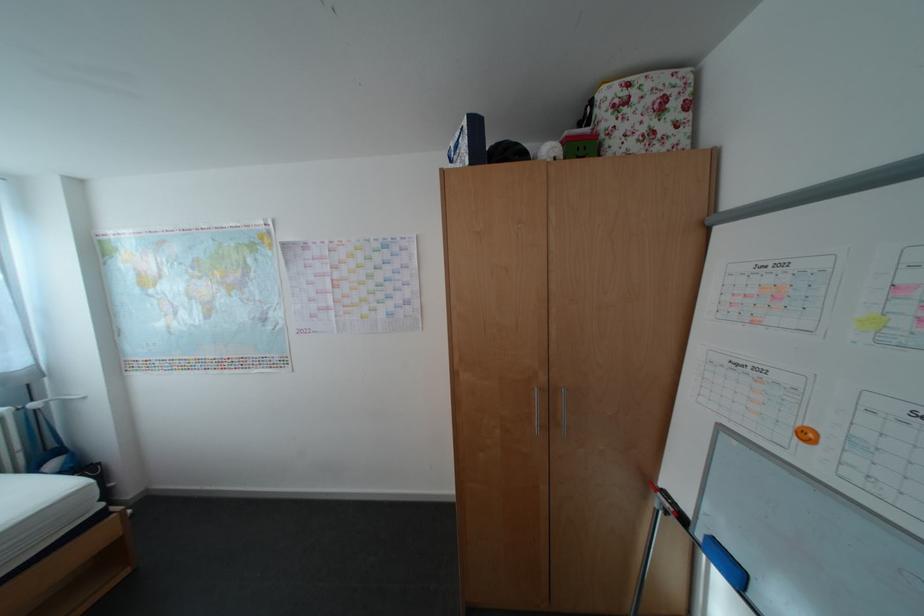
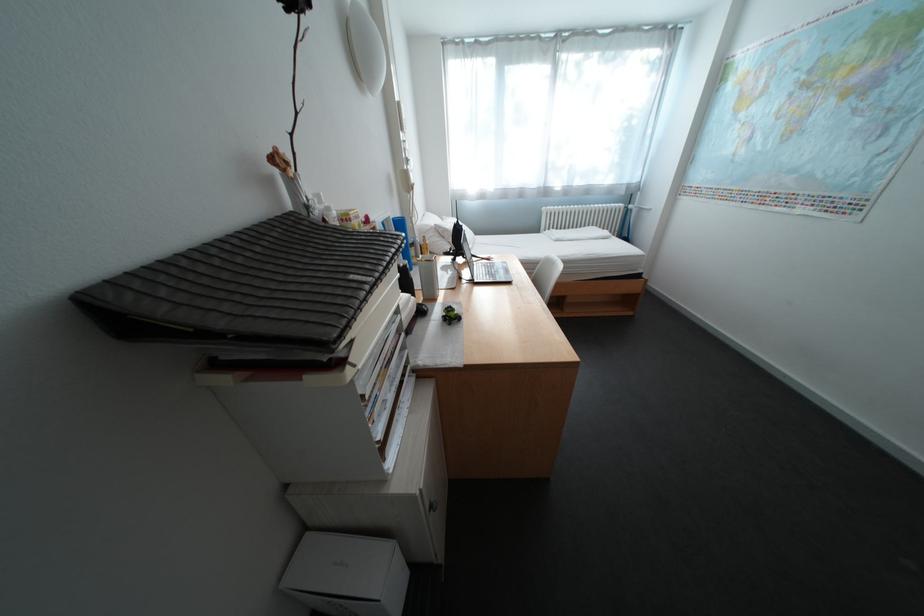
The first image is from the beginning of the video and the second image is from the end. How did the camera likely rotate when shooting the video?

The camera rotated toward left-down.